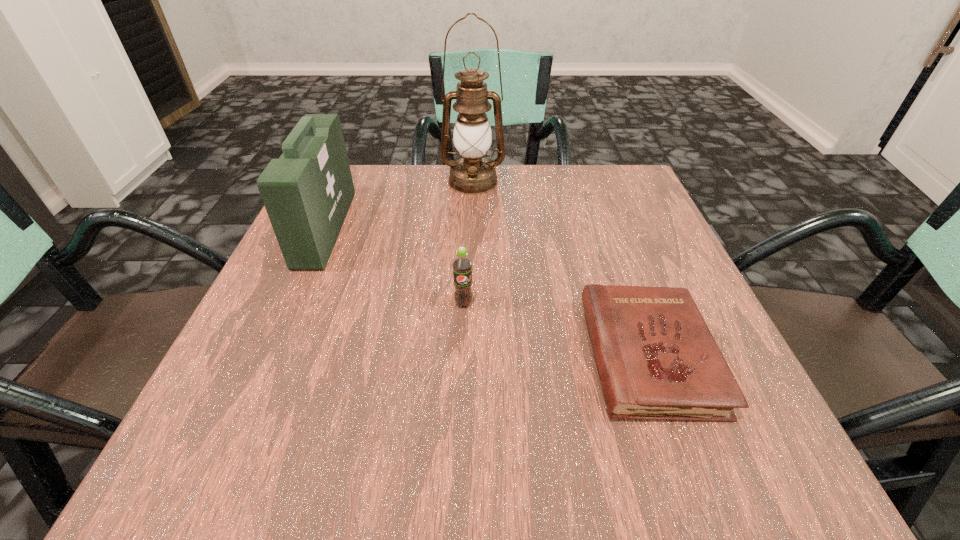
In order to click on the tallest object in this screenshot , I will do `click(472, 174)`.

Find the location of a particular element. the first-aid kit is located at coordinates (307, 192).

Find the location of `the leftmost object`. the leftmost object is located at coordinates (307, 192).

Identify the location of soda. The height and width of the screenshot is (540, 960). [462, 266].

The height and width of the screenshot is (540, 960). Identify the location of the rightmost object. (657, 359).

You are a GUI agent. You are given a task and a screenshot of the screen. Output one action in this format:
    pyautogui.click(x=<x>, y=<y>)
    Task: Click on the shortest object
    
    Given the screenshot: What is the action you would take?
    (657, 359)

At what (x,y) coordinates should I click in order to perform the action: click on vacant space located 0.230m on the right of the oil lamp. Please return your answer as a coordinate pair (x, y). Looking at the image, I should click on (600, 181).

Where is `free space located 0.120m on the front-facing side of the first-aid kit`? free space located 0.120m on the front-facing side of the first-aid kit is located at coordinates (399, 228).

At what (x,y) coordinates should I click in order to perform the action: click on vacant space positioned 0.260m on the front label of the third tallest object. Please return your answer as a coordinate pair (x, y). Image resolution: width=960 pixels, height=540 pixels. Looking at the image, I should click on (458, 461).

Locate an element on the screen. The height and width of the screenshot is (540, 960). vacant space situated 0.230m on the left of the shortest object is located at coordinates (441, 356).